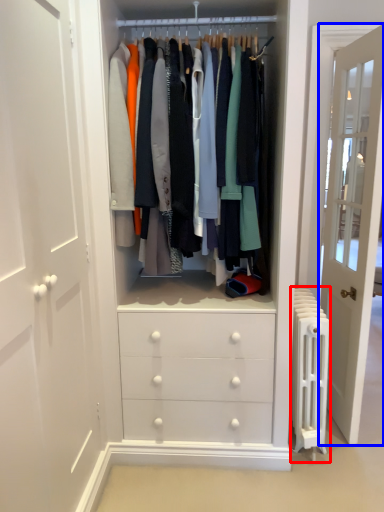
Question: Which point is further to the camera, radiator (highlighted by a red box) or door (highlighted by a blue box)?

Choices:
 (A) radiator
 (B) door

Answer: (B)